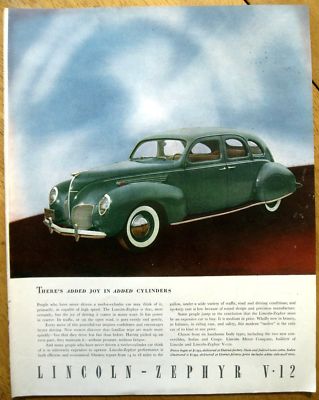
This screenshot has width=319, height=400. Identify the location of handle. (230, 165).